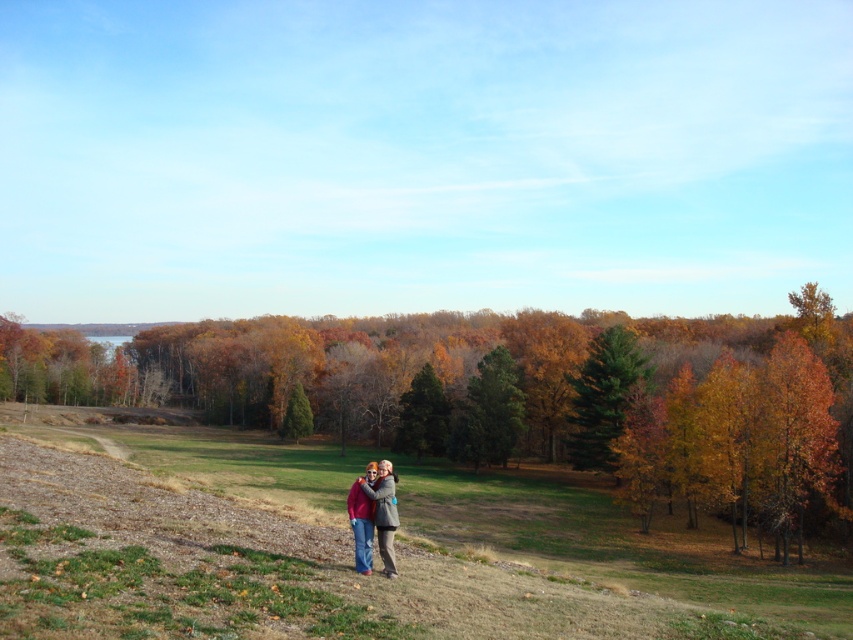
You are standing at the bottom left corner of the scene where the two individuals are posing. You want to walk directly towards the green matte tree at center. Which direction should you move relative to the tree?

The green matte tree at center is located at point (488, 412), so you should move towards the upper right direction to reach it.